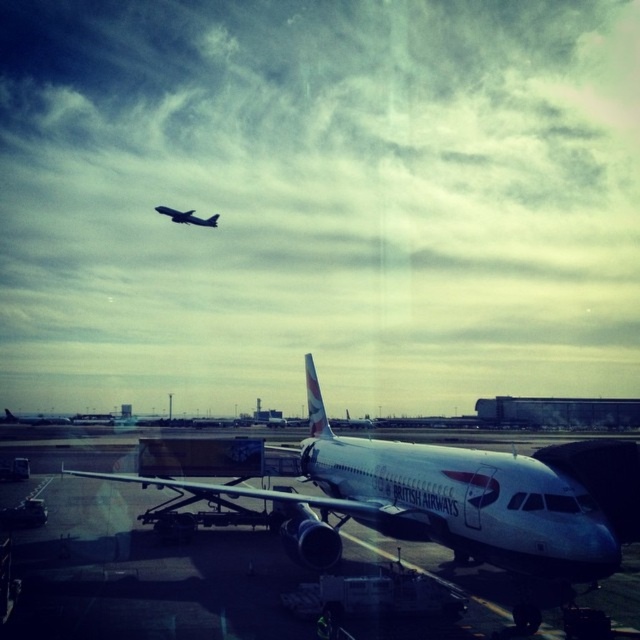
You are a pilot observing the airport runway. You notice a silver metallic airplane at center and a metallic silver airplane at upper center. Which one is closer to you?

The silver metallic airplane at center is closer to you because it is larger in size than the metallic silver airplane at upper center.